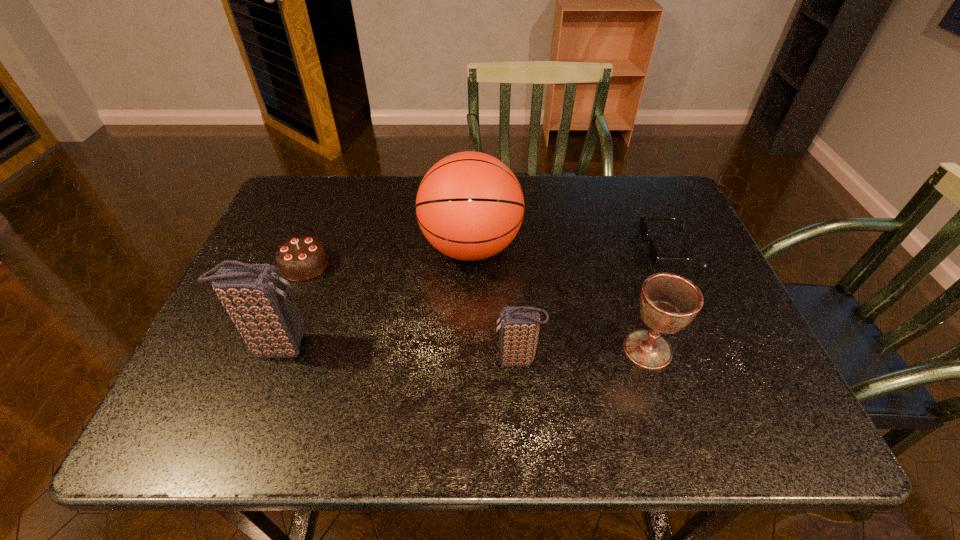
This screenshot has height=540, width=960. Identify the location of the taller clutch bag. (256, 296).

Locate an element on the screen. the shorter clutch bag is located at coordinates (519, 327).

Where is `sunglasses`? Image resolution: width=960 pixels, height=540 pixels. sunglasses is located at coordinates (652, 252).

This screenshot has width=960, height=540. Identify the location of the rightmost object. (652, 252).

I want to click on chocolate cake, so click(x=301, y=258).

Image resolution: width=960 pixels, height=540 pixels. In order to click on basketball in this screenshot , I will do `click(470, 206)`.

At what (x,y) coordinates should I click in order to perform the action: click on the second object from right to left. Please return your answer as a coordinate pair (x, y). Image resolution: width=960 pixels, height=540 pixels. Looking at the image, I should click on (668, 302).

Find the location of a particular element. This screenshot has height=540, width=960. free space located 0.250m with the zip open on the taller clutch bag is located at coordinates (428, 346).

I want to click on vacant point located with the zip open on the right clutch bag, so click(x=437, y=360).

Find the location of a particular element. vacant space located 0.130m with the zip open on the right clutch bag is located at coordinates (432, 360).